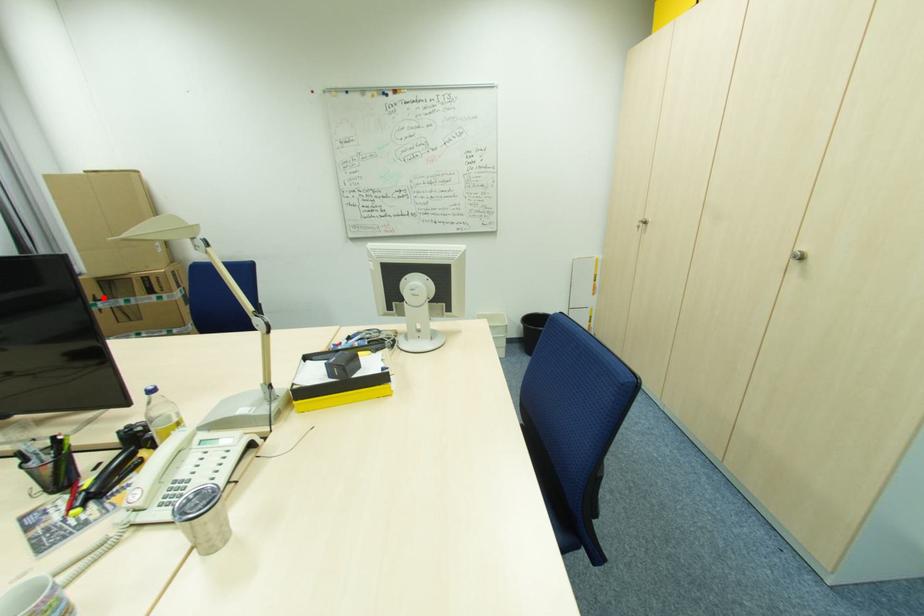
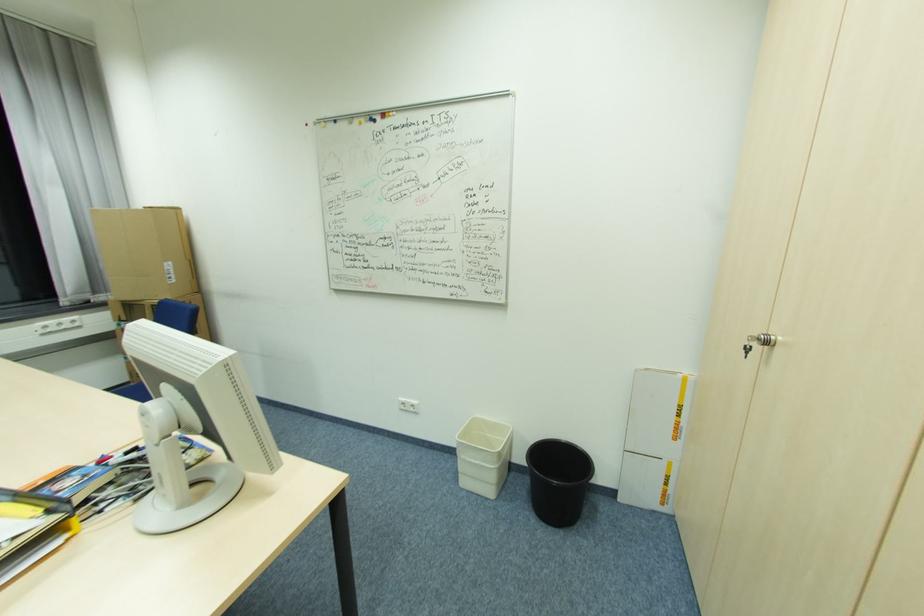
The point at the highlighted location is marked in the first image. Where is the corresponding point in the second image?

(127, 318)